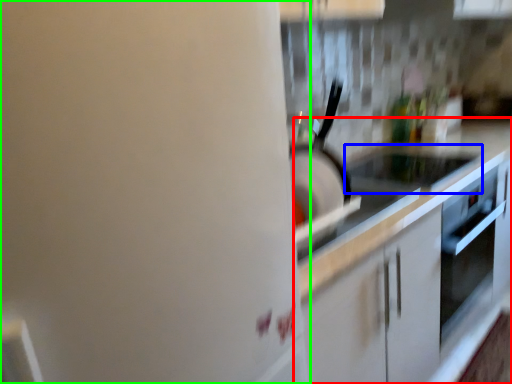
Question: Which object is positioned farthest from countertop (highlighted by a red box)? Select from appliance (highlighted by a blue box) and home appliance (highlighted by a green box).

Choices:
 (A) appliance
 (B) home appliance

Answer: (B)